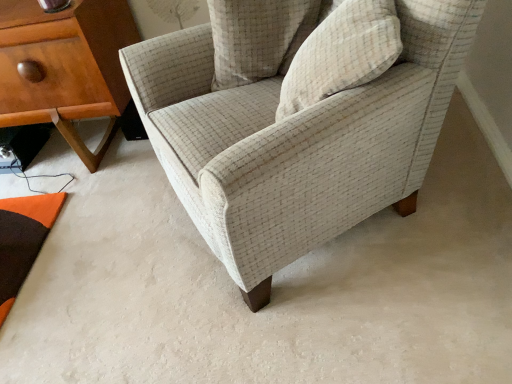
Question: Is wooden nightstand at left touching beige textured pillow at upper center, which is the 1th pillow in back-to-front order?

Choices:
 (A) no
 (B) yes

Answer: (A)

Question: From the image's perspective, is wooden nightstand at left located beneath beige textured pillow at upper center, which is the 1th pillow in back-to-front order?

Choices:
 (A) no
 (B) yes

Answer: (B)

Question: From the image's perspective, is wooden nightstand at left over beige textured pillow at upper center, which is the 1th pillow in back-to-front order?

Choices:
 (A) no
 (B) yes

Answer: (A)

Question: Is wooden nightstand at left wider than beige textured pillow at upper center, which is the 1th pillow in back-to-front order?

Choices:
 (A) no
 (B) yes

Answer: (B)

Question: Is wooden nightstand at left at the left side of beige textured pillow at upper center, placed as the second pillow when sorted from front to back?

Choices:
 (A) yes
 (B) no

Answer: (A)

Question: From the image's perspective, is textured beige armchair at center positioned above or below beige textured pillow at upper center, which is the 1th pillow in back-to-front order?

Choices:
 (A) above
 (B) below

Answer: (B)

Question: Considering the positions of textured beige armchair at center and beige textured pillow at upper center, which is the 1th pillow in back-to-front order, in the image, is textured beige armchair at center taller or shorter than beige textured pillow at upper center, which is the 1th pillow in back-to-front order,?

Choices:
 (A) short
 (B) tall

Answer: (B)

Question: In the image, is textured beige armchair at center on the left side or the right side of beige textured pillow at upper center, which is the 1th pillow in back-to-front order?

Choices:
 (A) right
 (B) left

Answer: (A)

Question: Is point (208, 115) positioned closer to the camera than point (286, 71)?

Choices:
 (A) closer
 (B) farther

Answer: (A)

Question: From the image's perspective, is beige textured pillow at upper center, marked as the first pillow in a front-to-back arrangement, above or below beige textured pillow at upper center, which is the 1th pillow in back-to-front order?

Choices:
 (A) above
 (B) below

Answer: (B)

Question: Would you say beige textured pillow at upper center, marked as the first pillow in a front-to-back arrangement, is inside or outside beige textured pillow at upper center, which is the 1th pillow in back-to-front order?

Choices:
 (A) outside
 (B) inside

Answer: (A)

Question: Considering the positions of beige textured pillow at upper center, acting as the 2th pillow starting from the back, and beige textured pillow at upper center, placed as the second pillow when sorted from front to back, in the image, is beige textured pillow at upper center, acting as the 2th pillow starting from the back, taller or shorter than beige textured pillow at upper center, placed as the second pillow when sorted from front to back,?

Choices:
 (A) short
 (B) tall

Answer: (A)

Question: Considering the positions of beige textured pillow at upper center, marked as the first pillow in a front-to-back arrangement, and beige textured pillow at upper center, which is the 1th pillow in back-to-front order, in the image, is beige textured pillow at upper center, marked as the first pillow in a front-to-back arrangement, bigger or smaller than beige textured pillow at upper center, which is the 1th pillow in back-to-front order,?

Choices:
 (A) big
 (B) small

Answer: (A)

Question: From the image's perspective, relative to beige textured pillow at upper center, which is the 1th pillow in back-to-front order, is wooden nightstand at left above or below?

Choices:
 (A) below
 (B) above

Answer: (A)

Question: From a real-world perspective, is wooden nightstand at left above or below beige textured pillow at upper center, placed as the second pillow when sorted from front to back?

Choices:
 (A) above
 (B) below

Answer: (B)